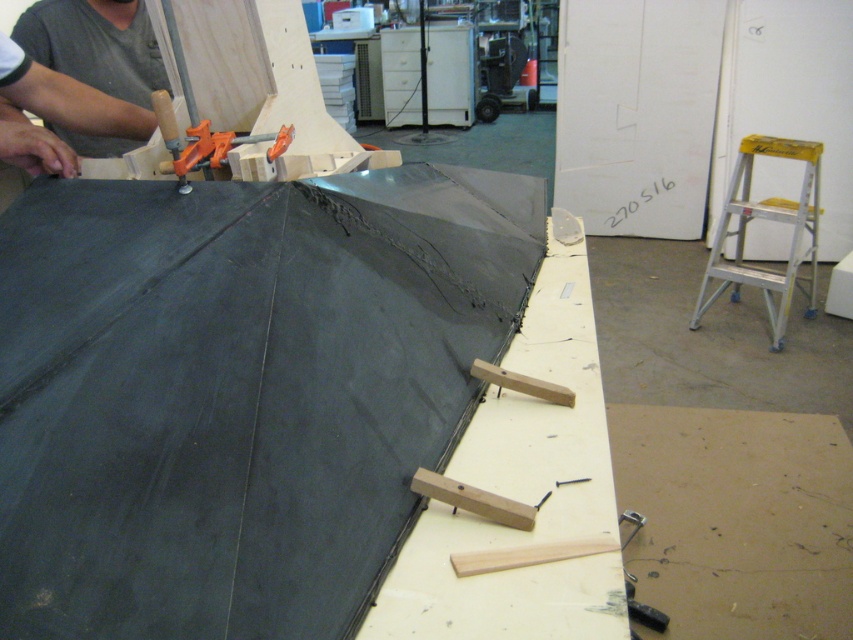
Who is more distant from viewer, (x=97, y=58) or (x=737, y=241)?

The point (x=737, y=241) is behind.

Does gray fabric at upper left appear under yellow aluminum stool at right?

Actually, gray fabric at upper left is above yellow aluminum stool at right.

Is point (122, 8) behind point (735, 212)?

That is False.

Locate an element on the screen. gray fabric at upper left is located at coordinates click(x=96, y=44).

Does brown matte plywood at lower right have a larger size compared to gray fabric at upper left?

Yes.

Between brown matte plywood at lower right and gray fabric at upper left, which one is positioned higher?

Positioned higher is gray fabric at upper left.

Between point (660, 440) and point (144, 83), which one is positioned in front?

Positioned in front is point (144, 83).

The height and width of the screenshot is (640, 853). What are the coordinates of `brown matte plywood at lower right` in the screenshot? It's located at (737, 518).

Is brown matte plywood at lower right thinner than yellow aluminum stool at right?

Incorrect, brown matte plywood at lower right's width is not less than yellow aluminum stool at right's.

What do you see at coordinates (737, 518) in the screenshot? I see `brown matte plywood at lower right` at bounding box center [737, 518].

This screenshot has height=640, width=853. What do you see at coordinates (737, 518) in the screenshot?
I see `brown matte plywood at lower right` at bounding box center [737, 518].

You are a GUI agent. You are given a task and a screenshot of the screen. Output one action in this format:
    pyautogui.click(x=<x>, y=<y>)
    Task: Click on the brown matte plywood at lower right
    This screenshot has width=853, height=640.
    Given the screenshot: What is the action you would take?
    pyautogui.click(x=737, y=518)